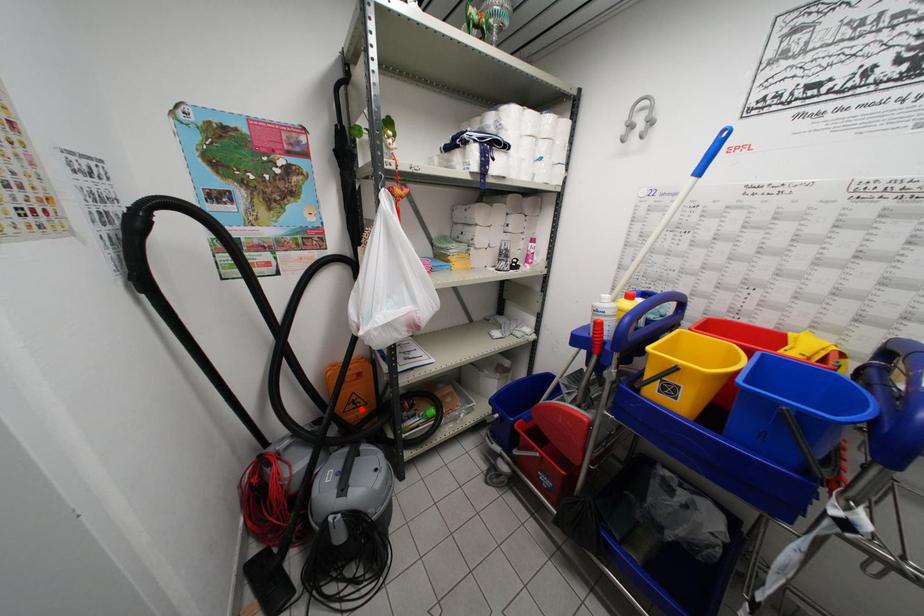
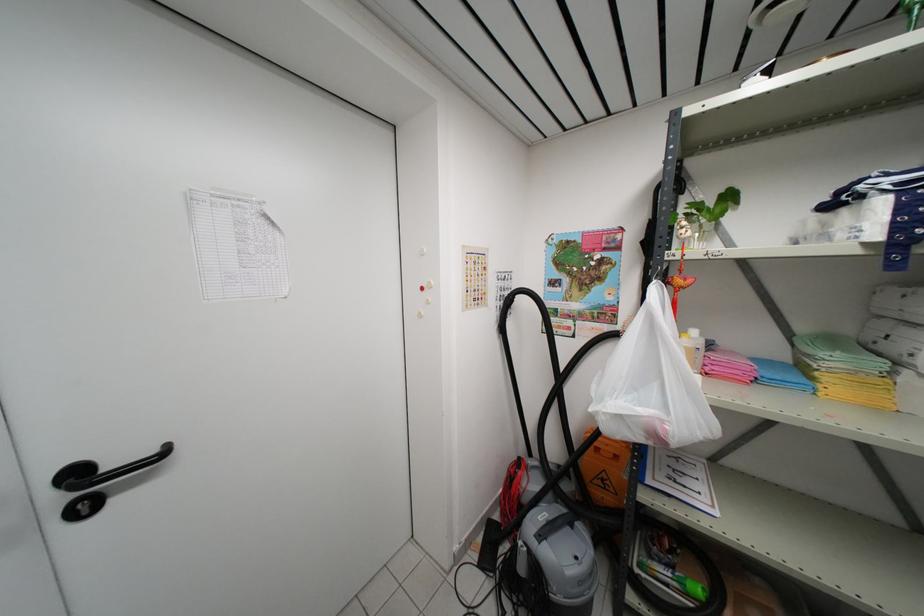
Question: I am providing you with two images of the same scene from different viewpoints. Image1 has a red point marked. In image2, the corresponding 3D location appears at what relative position? Reply with the corresponding letter.

Choices:
 (A) Closer
 (B) Farther

Answer: (B)